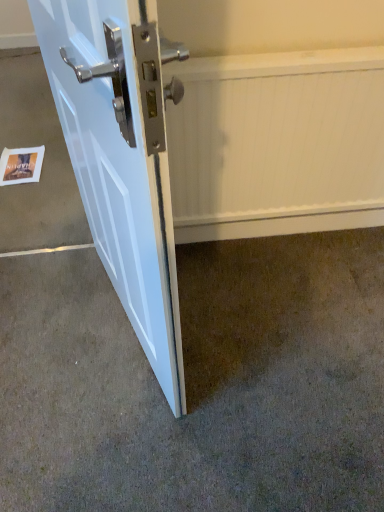
Question: From the image's perspective, is white glossy door at lower left under white paper postcard at lower left?

Choices:
 (A) no
 (B) yes

Answer: (B)

Question: From a real-world perspective, is white glossy door at lower left located higher than white paper postcard at lower left?

Choices:
 (A) yes
 (B) no

Answer: (A)

Question: Is white glossy door at lower left at the left side of white paper postcard at lower left?

Choices:
 (A) yes
 (B) no

Answer: (B)

Question: Is white glossy door at lower left not within white paper postcard at lower left?

Choices:
 (A) no
 (B) yes

Answer: (B)

Question: Can you confirm if white glossy door at lower left is shorter than white paper postcard at lower left?

Choices:
 (A) yes
 (B) no

Answer: (B)

Question: From a real-world perspective, is white glossy door at lower left below white paper postcard at lower left?

Choices:
 (A) no
 (B) yes

Answer: (A)

Question: Can you confirm if brown carpet at lower left is thinner than white paper postcard at lower left?

Choices:
 (A) no
 (B) yes

Answer: (A)

Question: From the image's perspective, is brown carpet at lower left located beneath white paper postcard at lower left?

Choices:
 (A) no
 (B) yes

Answer: (B)

Question: From a real-world perspective, is brown carpet at lower left on white paper postcard at lower left?

Choices:
 (A) no
 (B) yes

Answer: (A)

Question: Are brown carpet at lower left and white paper postcard at lower left far apart?

Choices:
 (A) no
 (B) yes

Answer: (B)

Question: Is brown carpet at lower left looking in the opposite direction of white paper postcard at lower left?

Choices:
 (A) no
 (B) yes

Answer: (A)

Question: Is brown carpet at lower left facing towards white paper postcard at lower left?

Choices:
 (A) no
 (B) yes

Answer: (B)

Question: From a real-world perspective, is white textured radiator at center on white glossy door at lower left?

Choices:
 (A) yes
 (B) no

Answer: (B)